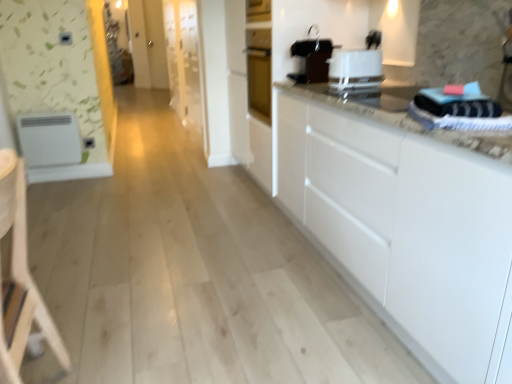
Question: From the image's perspective, is black plastic coffee maker at upper center, which appears as the 2th appliance when viewed from the back, positioned above or below white glossy toaster at upper center?

Choices:
 (A) below
 (B) above

Answer: (B)

Question: Would you say black plastic coffee maker at upper center, the 2th appliance positioned from the left, is inside or outside white glossy toaster at upper center?

Choices:
 (A) outside
 (B) inside

Answer: (A)

Question: Which object is the farthest from the white matte refrigerator at left, arranged as the 2th appliance when viewed from the front?

Choices:
 (A) light wood armchair at left
 (B) black plastic coffee maker at upper center, which is counted as the first appliance, starting from the top
 (C) white glossy toaster at upper center

Answer: (C)

Question: Estimate the real-world distances between objects in this image. Which object is closer to the light wood armchair at left?

Choices:
 (A) white matte refrigerator at left, arranged as the first appliance when viewed from the back
 (B) white glossy toaster at upper center
 (C) black plastic coffee maker at upper center, placed as the 1th appliance when sorted from right to left

Answer: (B)